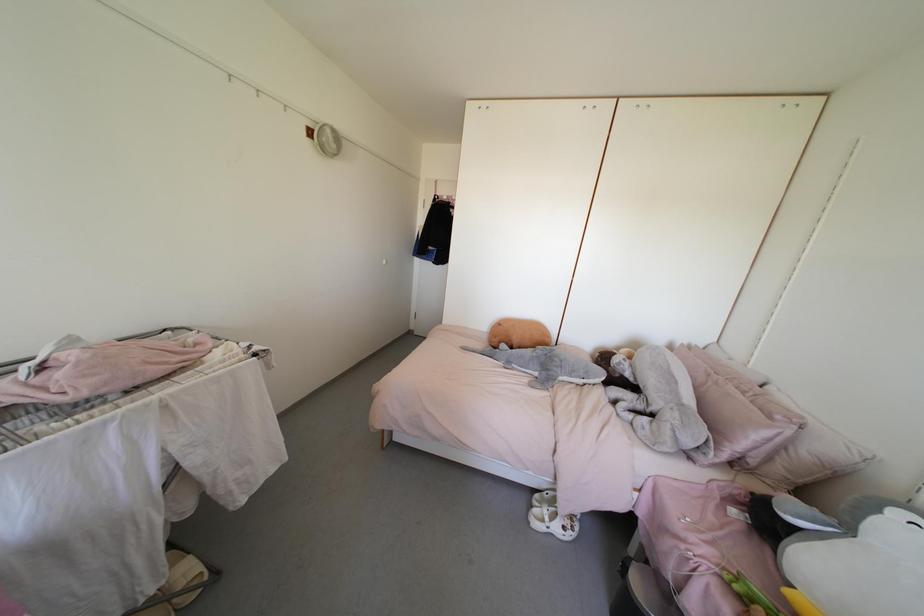
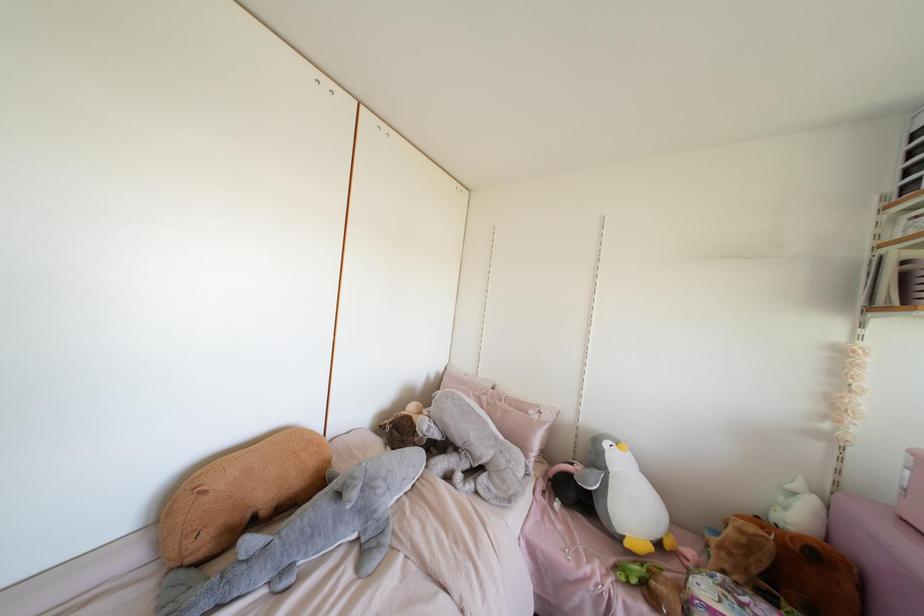
Locate, in the second image, the point that corresponds to (x=573, y=371) in the first image.

(403, 479)